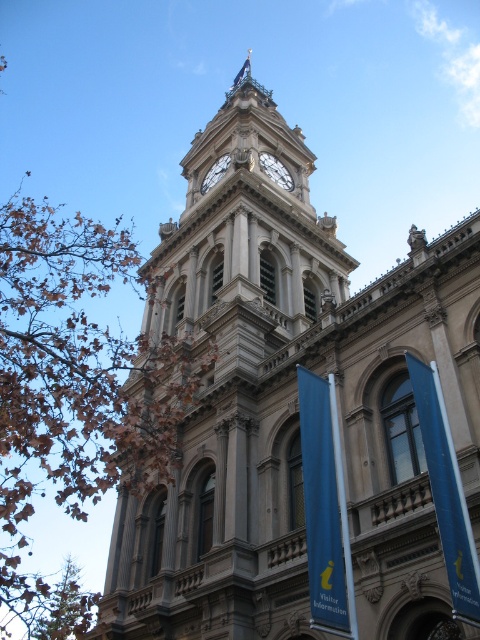
Can you confirm if brown leafy tree at left is positioned to the right of blue fabric flag at center?

In fact, brown leafy tree at left is to the left of blue fabric flag at center.

Looking at this image, does brown leafy tree at left have a lesser width compared to blue fabric flag at center?

No.

Which is behind, point (25, 196) or point (345, 580)?

The point (25, 196) is more distant.

You are a GUI agent. You are given a task and a screenshot of the screen. Output one action in this format:
    pyautogui.click(x=<x>, y=<y>)
    Task: Click on the brown leafy tree at left
    The image size is (480, 640).
    Given the screenshot: What is the action you would take?
    pyautogui.click(x=74, y=394)

Is gold metallic clock at center thinner than white stone clock at center?

Incorrect, gold metallic clock at center's width is not less than white stone clock at center's.

Is gold metallic clock at center above white stone clock at center?

Yes.

Is point (264, 157) in front of point (216, 168)?

Yes, point (264, 157) is in front of point (216, 168).

I want to click on gold metallic clock at center, so click(276, 170).

Can you confirm if white stone clock at center is bigger than blue fabric flag at upper center?

Actually, white stone clock at center might be smaller than blue fabric flag at upper center.

Can you confirm if white stone clock at center is positioned below blue fabric flag at upper center?

Yes, white stone clock at center is below blue fabric flag at upper center.

What do you see at coordinates (215, 172) in the screenshot?
I see `white stone clock at center` at bounding box center [215, 172].

Identify the location of white stone clock at center. (215, 172).